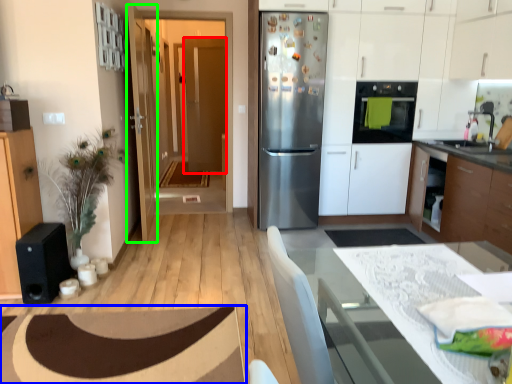
Question: Which is nearer to the door (highlighted by a red box)? plain (highlighted by a blue box) or door (highlighted by a green box).

Choices:
 (A) plain
 (B) door

Answer: (B)